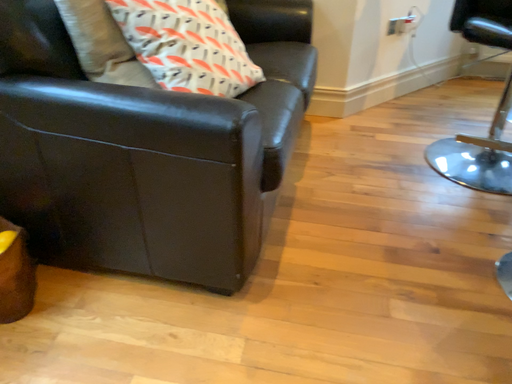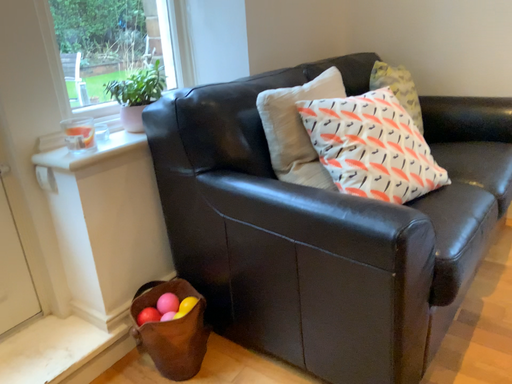
Question: How did the camera likely rotate when shooting the video?

Choices:
 (A) rotated upward
 (B) rotated downward

Answer: (A)